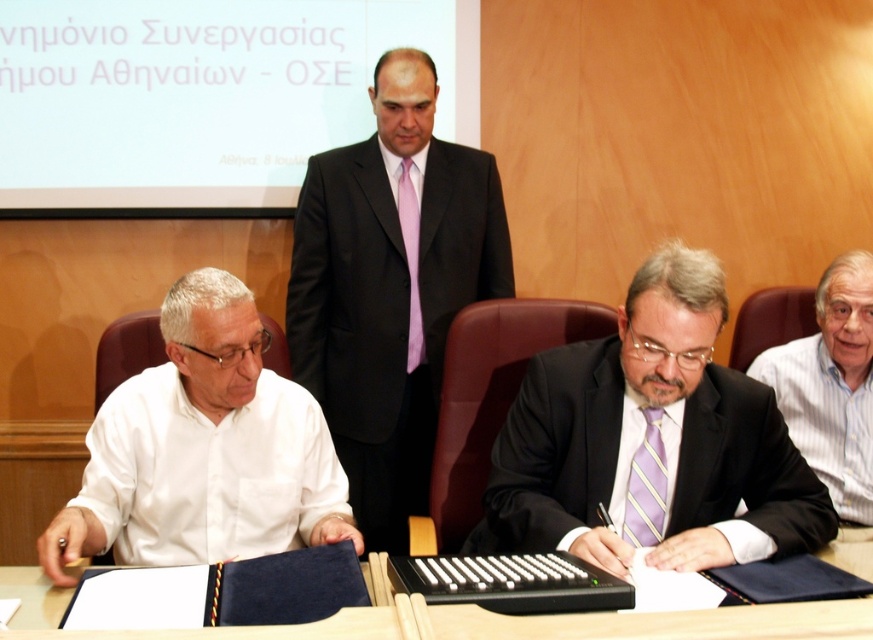
Which of these two, purple striped tie at center or white shirt at left, stands taller?

purple striped tie at center is taller.

Does point (688, 496) come farther from viewer compared to point (344, 499)?

No, it is in front of (344, 499).

The image size is (873, 640). Identify the location of purple striped tie at center. (651, 442).

Does purple striped tie at center have a smaller size compared to pink silk tie at center?

No, purple striped tie at center is not smaller than pink silk tie at center.

Is purple striped tie at center further to camera compared to pink silk tie at center?

No, it is in front of pink silk tie at center.

Find the location of a particular element. The image size is (873, 640). purple striped tie at center is located at coordinates (651, 442).

What do you see at coordinates (204, 449) in the screenshot? The height and width of the screenshot is (640, 873). I see `white shirt at left` at bounding box center [204, 449].

Between white shirt at left and dark blue leather table at lower center, which one has less height?

dark blue leather table at lower center

The image size is (873, 640). What are the coordinates of `white shirt at left` in the screenshot? It's located at (204, 449).